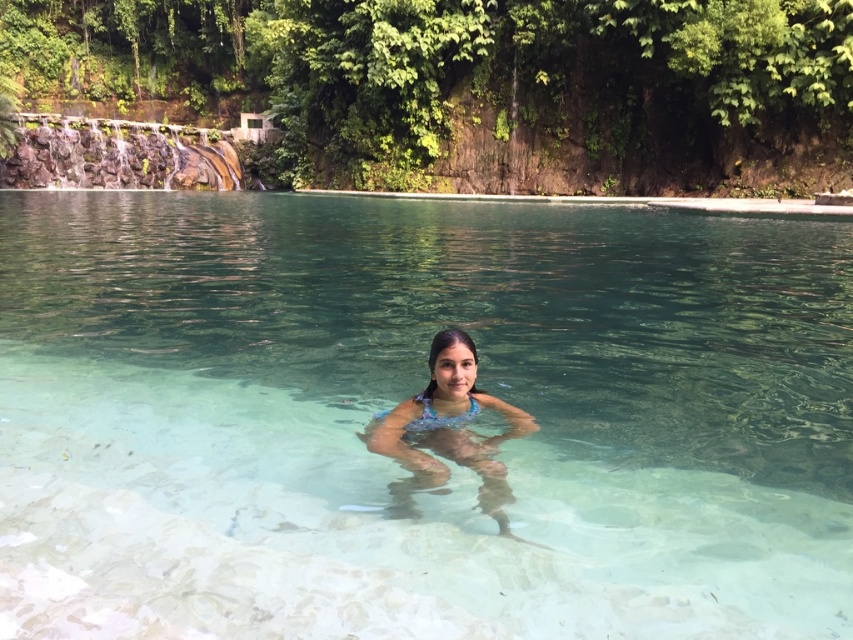
Is clear glass pool at center taller than translucent blue bikini at center?

Yes, clear glass pool at center is taller than translucent blue bikini at center.

Who is more forward, (x=584, y=474) or (x=527, y=432)?

Positioned in front is point (x=584, y=474).

Which is in front, point (289, 477) or point (469, 396)?

Point (289, 477) is in front.

Where is `clear glass pool at center`? The image size is (853, 640). clear glass pool at center is located at coordinates (413, 394).